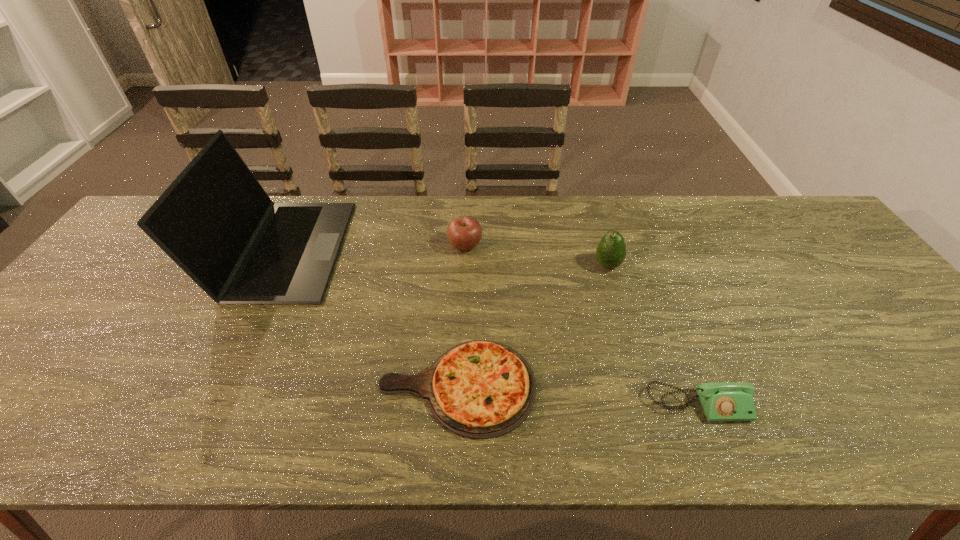
Locate an element on the screen. The height and width of the screenshot is (540, 960). blank area in the image that satisfies the following two spatial constraints: 1. on the back side of the pizza; 2. on the screen of the tallest object is located at coordinates (463, 249).

At what (x,y) coordinates should I click in order to perform the action: click on vacant position in the image that satisfies the following two spatial constraints: 1. on the back side of the fourth shortest object; 2. on the side of the apple with the unique marking. Please return your answer as a coordinate pair (x, y). Looking at the image, I should click on (602, 245).

Identify the location of vacant space that satisfies the following two spatial constraints: 1. on the back side of the shortest object; 2. on the screen of the laptop. (463, 249).

This screenshot has height=540, width=960. What are the coordinates of `free space that satisfies the following two spatial constraints: 1. on the screen of the tallest object; 2. on the left side of the avocado` in the screenshot? It's located at (275, 266).

This screenshot has width=960, height=540. Find the location of `free spot that satisfies the following two spatial constraints: 1. on the screen of the tallest object; 2. on the right side of the fourth shortest object`. free spot that satisfies the following two spatial constraints: 1. on the screen of the tallest object; 2. on the right side of the fourth shortest object is located at coordinates (275, 266).